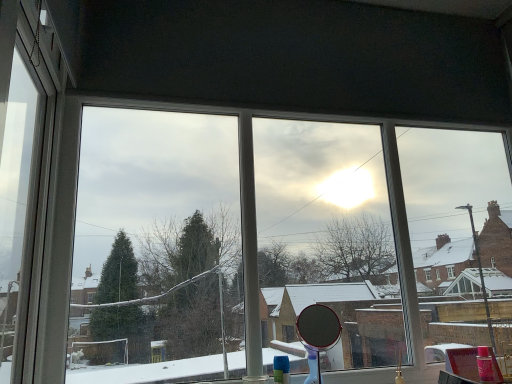
Question: From a real-world perspective, is white plastic window frame at left physically above transparent glass mirror at center?

Choices:
 (A) yes
 (B) no

Answer: (A)

Question: From the image's perspective, is white plastic window frame at left over transparent glass mirror at center?

Choices:
 (A) yes
 (B) no

Answer: (A)

Question: Is white plastic window frame at left located outside transparent glass mirror at center?

Choices:
 (A) no
 (B) yes

Answer: (B)

Question: Could transparent glass mirror at center be considered to be inside white plastic window frame at left?

Choices:
 (A) yes
 (B) no

Answer: (B)

Question: Considering the relative sizes of white plastic window frame at left and transparent glass mirror at center in the image provided, is white plastic window frame at left shorter than transparent glass mirror at center?

Choices:
 (A) yes
 (B) no

Answer: (B)

Question: From the image's perspective, relative to white plastic window frame at left, is transparent glass mirror at center above or below?

Choices:
 (A) below
 (B) above

Answer: (A)

Question: In terms of width, does transparent glass mirror at center look wider or thinner when compared to white plastic window frame at left?

Choices:
 (A) wide
 (B) thin

Answer: (A)

Question: Considering the positions of transparent glass mirror at center and white plastic window frame at left in the image, is transparent glass mirror at center taller or shorter than white plastic window frame at left?

Choices:
 (A) short
 (B) tall

Answer: (A)

Question: Based on their sizes in the image, would you say transparent glass mirror at center is bigger or smaller than white plastic window frame at left?

Choices:
 (A) small
 (B) big

Answer: (B)

Question: Does point (310, 347) appear closer or farther from the camera than point (32, 79)?

Choices:
 (A) closer
 (B) farther

Answer: (B)

Question: From a real-world perspective, relative to white plastic window frame at left, is polished silver mirror at center vertically above or below?

Choices:
 (A) above
 (B) below

Answer: (B)

Question: Is polished silver mirror at center to the left or to the right of white plastic window frame at left in the image?

Choices:
 (A) right
 (B) left

Answer: (A)

Question: Relative to white plastic window frame at left, is polished silver mirror at center in front or behind?

Choices:
 (A) behind
 (B) front

Answer: (A)

Question: From a real-world perspective, is polished silver mirror at center positioned above or below transparent glass mirror at center?

Choices:
 (A) above
 (B) below

Answer: (B)

Question: Is polished silver mirror at center bigger or smaller than transparent glass mirror at center?

Choices:
 (A) big
 (B) small

Answer: (B)